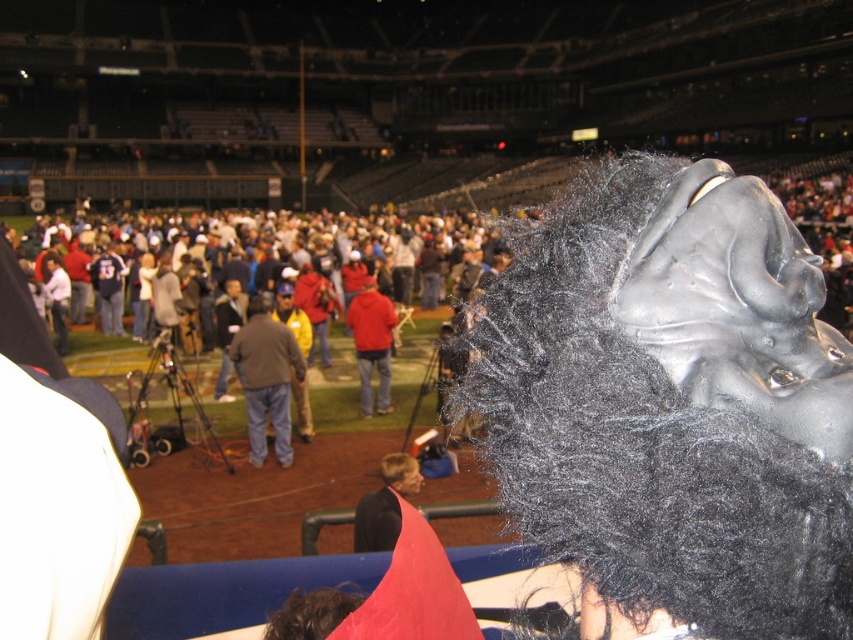
Can you confirm if shiny metallic gorilla head at upper right is smaller than red matte jacket at center?

Indeed, shiny metallic gorilla head at upper right has a smaller size compared to red matte jacket at center.

Locate an element on the screen. The image size is (853, 640). shiny metallic gorilla head at upper right is located at coordinates (672, 404).

In order to click on shiny metallic gorilla head at upper right in this screenshot , I will do `click(672, 404)`.

Who is taller, brown leather jacket at center or dark brown leather jacket at center?

brown leather jacket at center

Does brown leather jacket at center come in front of dark brown leather jacket at center?

Yes, brown leather jacket at center is closer to the viewer.

Identify the location of brown leather jacket at center. (265, 378).

Who is more distant from viewer, (701, 380) or (228, 332)?

The point (228, 332) is more distant.

Is point (747, 403) positioned before point (218, 380)?

Yes, point (747, 403) is closer to viewer.

The width and height of the screenshot is (853, 640). Identify the location of shiny metallic gorilla head at upper right. (672, 404).